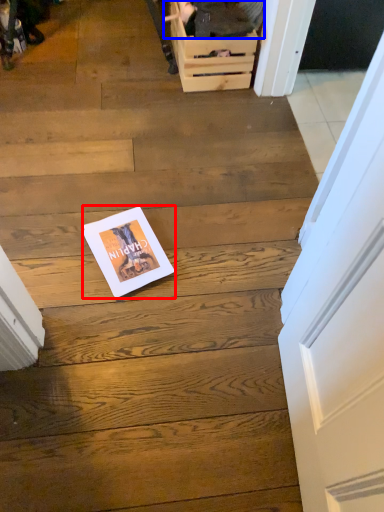
Question: Which object appears closest to the camera in this image, magazine (highlighted by a red box) or couple (highlighted by a blue box)?

Choices:
 (A) magazine
 (B) couple

Answer: (A)